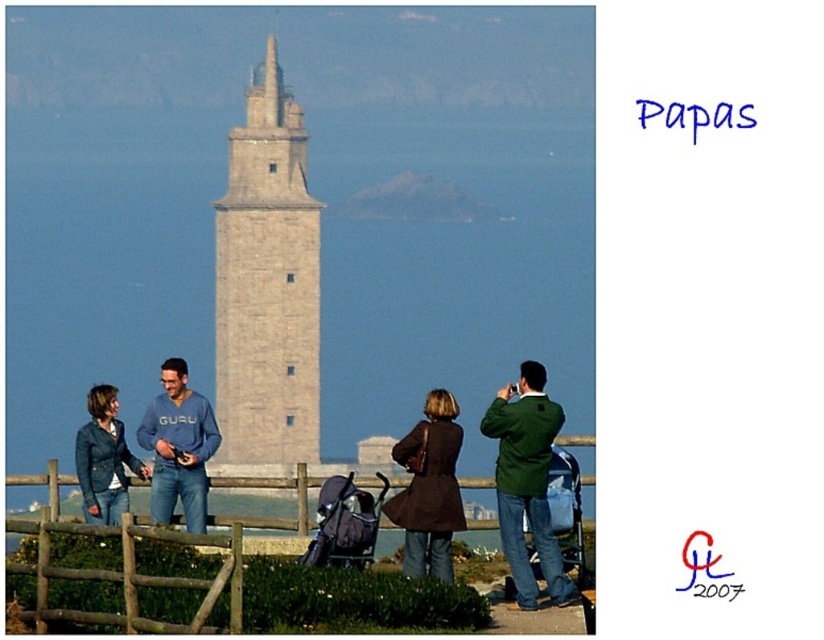
Question: Among these objects, which one is farthest from the camera?

Choices:
 (A) stone tower at center
 (B) matte blue sweatshirt at center
 (C) matte blue jacket at lower left
 (D) green matte jacket at center

Answer: (C)

Question: Is green matte jacket at center above matte blue sweatshirt at center?

Choices:
 (A) yes
 (B) no

Answer: (B)

Question: Can you confirm if matte blue sweatshirt at center is positioned to the right of wooden at center?

Choices:
 (A) yes
 (B) no

Answer: (B)

Question: Based on their relative distances, which object is nearer to the green matte jacket at center?

Choices:
 (A) wooden at center
 (B) matte blue sweatshirt at center
 (C) matte blue jacket at lower left

Answer: (A)

Question: Considering the real-world distances, which object is farthest from the stone tower at center?

Choices:
 (A) green matte jacket at center
 (B) matte blue jacket at lower left
 (C) brown leather coat at center

Answer: (A)

Question: Is stone tower at center in front of matte blue sweatshirt at center?

Choices:
 (A) yes
 (B) no

Answer: (B)